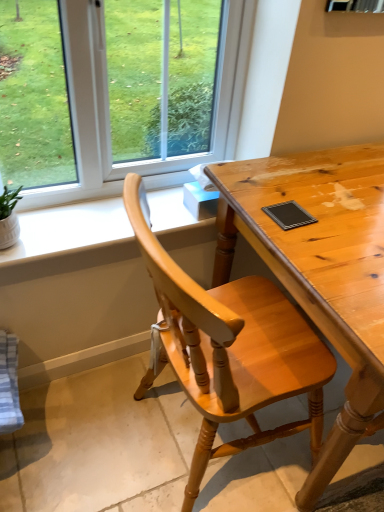
Question: Relative to light brown wooden desk at center, is white matte window sill at upper left in front or behind?

Choices:
 (A) behind
 (B) front

Answer: (A)

Question: From their relative heights in the image, would you say white matte window sill at upper left is taller or shorter than light brown wooden desk at center?

Choices:
 (A) short
 (B) tall

Answer: (A)

Question: Which object is positioned closest to the light brown wooden desk at center?

Choices:
 (A) white matte window sill at upper left
 (B) light brown wooden chair at center

Answer: (B)

Question: Which object is positioned closest to the white matte window sill at upper left?

Choices:
 (A) light brown wooden chair at center
 (B) light brown wooden desk at center

Answer: (B)